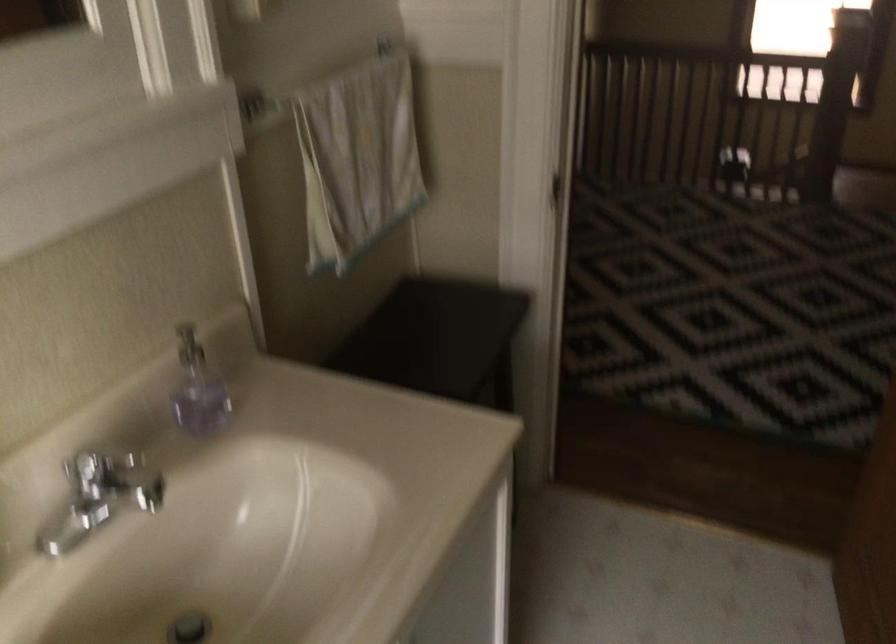
Find the location of a particular element. This screenshot has width=896, height=644. chrome faucet handle is located at coordinates (108, 471).